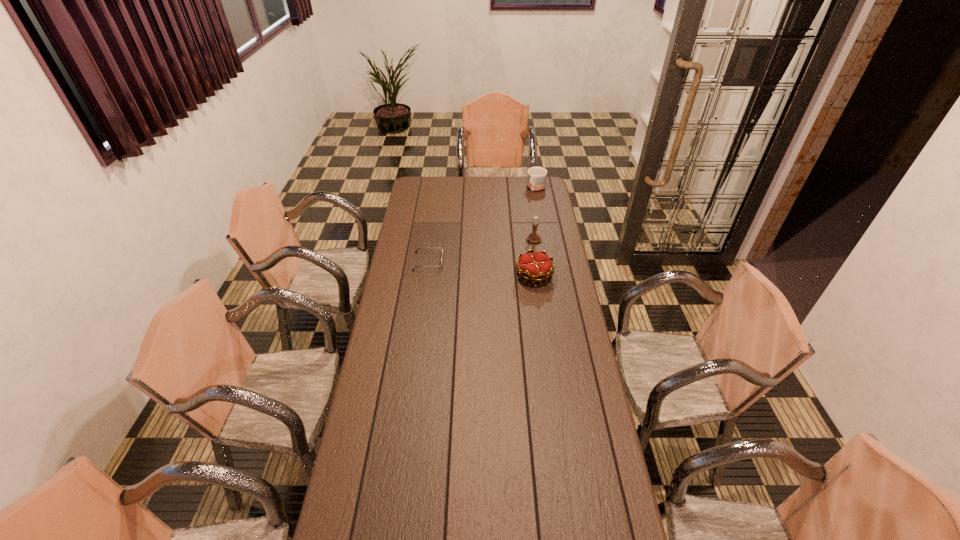
In the image, there is a desktop. At what (x,y) coordinates should I click in order to perform the action: click on free space at the far edge. Please return your answer as a coordinate pair (x, y). This screenshot has width=960, height=540. Looking at the image, I should click on (507, 185).

Where is `free space at the near edge of the desktop`? The height and width of the screenshot is (540, 960). free space at the near edge of the desktop is located at coordinates (539, 517).

In the image, there is a desktop. Identify the location of vacant space at the left edge. [379, 463].

You are a GUI agent. You are given a task and a screenshot of the screen. Output one action in this format:
    pyautogui.click(x=<x>, y=<y>)
    Task: Click on the vacant space at the right edge
    The image size is (960, 540).
    Given the screenshot: What is the action you would take?
    pyautogui.click(x=545, y=227)

This screenshot has height=540, width=960. Find the location of `vacant space at the far left corner of the desktop`. vacant space at the far left corner of the desktop is located at coordinates (432, 194).

Locate an element on the screen. Image resolution: width=960 pixels, height=540 pixels. free space at the near left corner of the desktop is located at coordinates (388, 518).

In the image, there is a desktop. Identify the location of vacant region at the far right corner. Image resolution: width=960 pixels, height=540 pixels. (546, 192).

In the image, there is a desktop. Where is `vacant space at the near right corner`? vacant space at the near right corner is located at coordinates (610, 535).

Locate an element on the screen. The width and height of the screenshot is (960, 540). vacant region between the sunglasses and the second farthest object is located at coordinates (481, 251).

This screenshot has height=540, width=960. I want to click on free space between the leftmost object and the tallest object, so click(x=481, y=251).